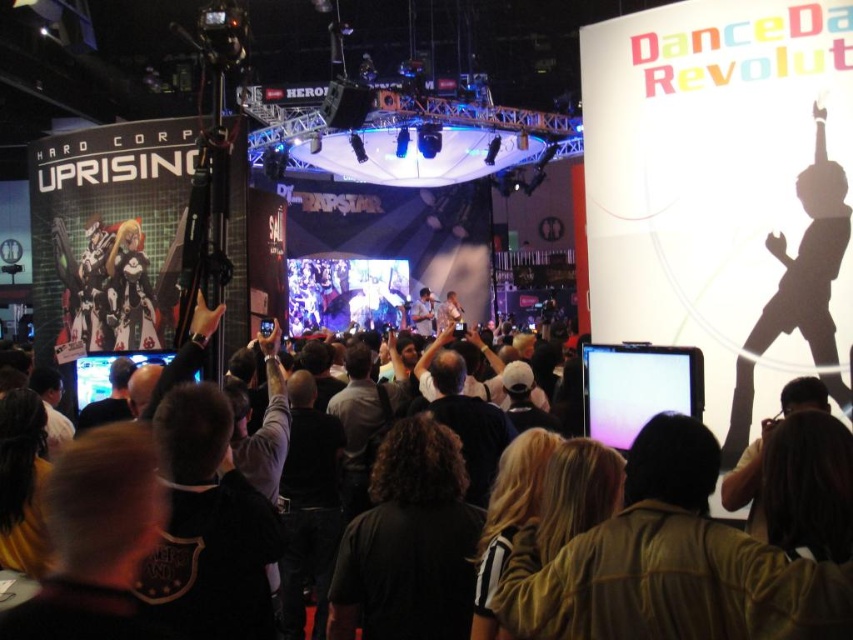
Consider the image. Does dark clothing crowd at center have a greater height compared to matte black tablet at center?

Yes, dark clothing crowd at center is taller than matte black tablet at center.

Does dark clothing crowd at center have a larger size compared to matte black tablet at center?

Yes.

Measure the distance between point (734, 621) and camera.

A distance of 36.38 meters exists between point (734, 621) and camera.

You are a GUI agent. You are given a task and a screenshot of the screen. Output one action in this format:
    pyautogui.click(x=<x>, y=<y>)
    Task: Click on the dark clothing crowd at center
    This screenshot has height=640, width=853.
    Given the screenshot: What is the action you would take?
    pyautogui.click(x=671, y=564)

Can you confirm if shiny silver stage at center is shorter than matte black monitor at center?

In fact, shiny silver stage at center may be taller than matte black monitor at center.

Does shiny silver stage at center appear on the right side of matte black monitor at center?

Correct, you'll find shiny silver stage at center to the right of matte black monitor at center.

Image resolution: width=853 pixels, height=640 pixels. Describe the element at coordinates (345, 292) in the screenshot. I see `shiny silver stage at center` at that location.

Identify the location of shiny silver stage at center. The width and height of the screenshot is (853, 640). (345, 292).

Is point (782, 244) closer to viewer compared to point (103, 392)?

Yes, point (782, 244) is in front of point (103, 392).

Describe the element at coordinates (799, 289) in the screenshot. This screenshot has height=640, width=853. I see `black matte silhouette at upper right` at that location.

The image size is (853, 640). What do you see at coordinates (799, 289) in the screenshot? I see `black matte silhouette at upper right` at bounding box center [799, 289].

Identify the location of black matte silhouette at upper right. This screenshot has width=853, height=640. (799, 289).